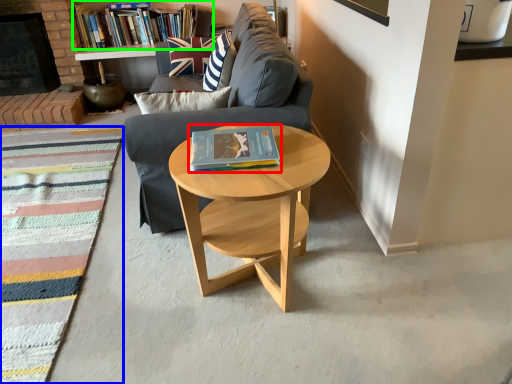
Question: Based on their relative distances, which object is farther from book (highlighted by a red box)? Choose from mat (highlighted by a blue box) and book (highlighted by a green box).

Choices:
 (A) mat
 (B) book

Answer: (B)